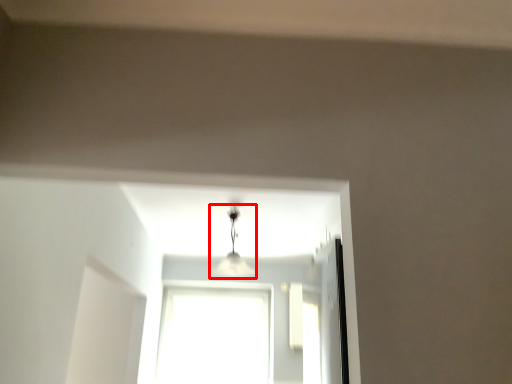
Question: Where is lamp (annotated by the red box) located in relation to window in the image?

Choices:
 (A) right
 (B) left

Answer: (A)